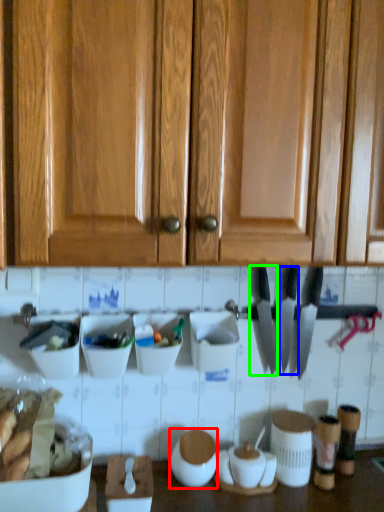
Question: Estimate the real-world distances between objects in this image. Which object is closer to appliance (highlighted by a red box), knife (highlighted by a blue box) or knife (highlighted by a green box)?

Choices:
 (A) knife
 (B) knife

Answer: (B)